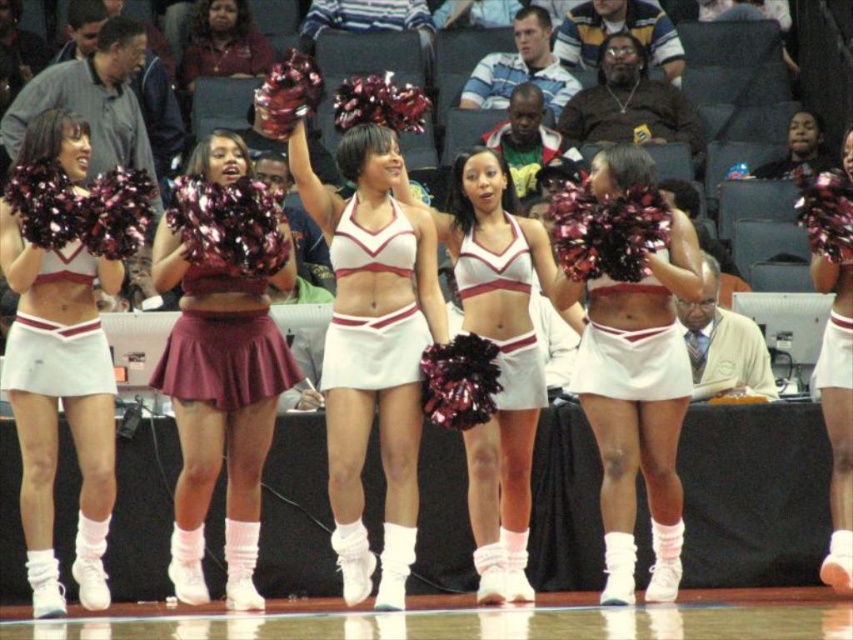
You are a photographer positioned at the back of the court. You want to take a photo of the white matte cheerleading uniform at center without the white matte cheerleading outfit at center blocking it. Is this possible?

The white matte cheerleading outfit at center is in front of the white matte cheerleading uniform at center, so it will block the view. Move closer or ask the outfit to step aside to capture the uniform behind.

You are a photographer standing at the edge of the basketball court, and you want to take a photo that includes both the point at coordinates point (375,241) and point (460,296). Which point will appear closer to the bottom of the photo?

Point (375,241) is closer to the camera than point (460,296), so in the photo, point (375,241) will appear closer to the bottom of the photo.

You are a photographer at the basketball court and want to capture a photo of the white matte cheerleading outfit at center and the white matte cheerleading uniform at center. Based on their positions, which one is positioned lower in the image?

The white matte cheerleading outfit at center is located below the white matte cheerleading uniform at center, so the white matte cheerleading outfit at center is positioned lower in the image.